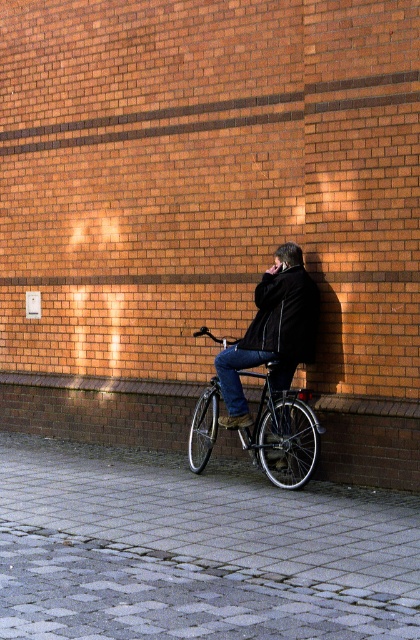
Based on the photo, which is more to the right, gray cobblestone pavement at lower left or dark wool coat at center?

dark wool coat at center is more to the right.

From the picture: Can you confirm if gray cobblestone pavement at lower left is positioned above dark wool coat at center?

Actually, gray cobblestone pavement at lower left is below dark wool coat at center.

At what (x,y) coordinates should I click in order to perform the action: click on gray cobblestone pavement at lower left. Please return your answer as a coordinate pair (x, y). Looking at the image, I should click on (196, 552).

In order to click on gray cobblestone pavement at lower left in this screenshot , I will do `click(196, 552)`.

Is point (304, 394) closer to viewer compared to point (298, 314)?

That is True.

Can you confirm if shiny metallic bicycle at center is wider than black matte jacket at center?

Indeed, shiny metallic bicycle at center has a greater width compared to black matte jacket at center.

You are a GUI agent. You are given a task and a screenshot of the screen. Output one action in this format:
    pyautogui.click(x=<x>, y=<y>)
    Task: Click on the shiny metallic bicycle at center
    This screenshot has height=640, width=420.
    Given the screenshot: What is the action you would take?
    pyautogui.click(x=283, y=433)

Image resolution: width=420 pixels, height=640 pixels. What do you see at coordinates (196, 552) in the screenshot?
I see `gray cobblestone pavement at lower left` at bounding box center [196, 552].

At what (x,y) coordinates should I click in order to perform the action: click on gray cobblestone pavement at lower left. Please return your answer as a coordinate pair (x, y). The width and height of the screenshot is (420, 640). Looking at the image, I should click on (196, 552).

Which is behind, point (160, 627) or point (257, 333)?

The point (257, 333) is behind.

Locate an element on the screen. gray cobblestone pavement at lower left is located at coordinates (196, 552).